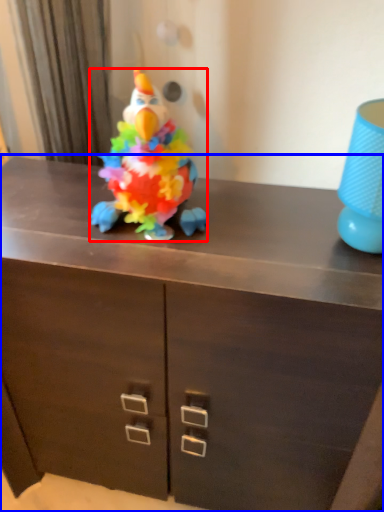
Question: Among these objects, which one is nearest to the camera, toy (highlighted by a red box) or chest of drawers (highlighted by a blue box)?

Choices:
 (A) toy
 (B) chest of drawers

Answer: (B)